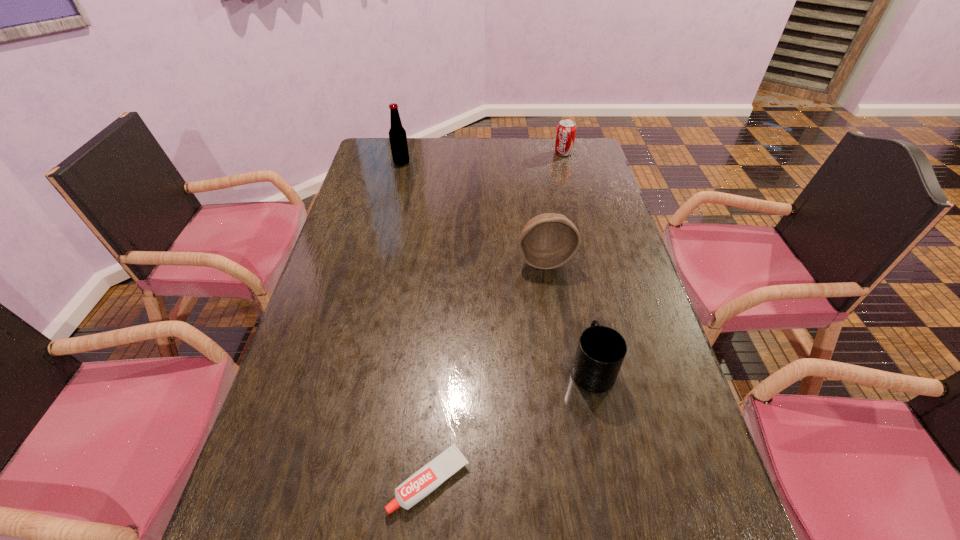
Locate an element on the screen. object located in the far left corner section of the desktop is located at coordinates (397, 135).

Identify the location of object at the far right corner. The height and width of the screenshot is (540, 960). (566, 130).

The image size is (960, 540). Identify the location of free space at the far edge of the desktop. (x=524, y=160).

In the image, there is a desktop. Where is `free space at the left edge`? free space at the left edge is located at coordinates (379, 273).

I want to click on free space at the right edge, so click(605, 200).

Locate an element on the screen. This screenshot has width=960, height=540. vacant space at the far right corner is located at coordinates (570, 170).

At what (x,y) coordinates should I click in order to perform the action: click on vacant region between the second farthest object and the toothpaste. Please return your answer as a coordinate pair (x, y). Looking at the image, I should click on (416, 322).

Locate an element on the screen. The height and width of the screenshot is (540, 960). free point between the second tallest object and the shortest object is located at coordinates (487, 370).

At what (x,y) coordinates should I click in order to perform the action: click on vacant space that is in between the bowl and the mug. Please return your answer as a coordinate pair (x, y). The height and width of the screenshot is (540, 960). Looking at the image, I should click on (568, 315).

Locate an element on the screen. free point between the mug and the leftmost object is located at coordinates (496, 266).